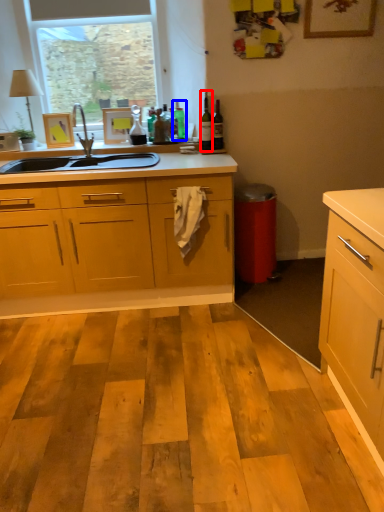
Question: Among these objects, which one is farthest to the camera, bottle (highlighted by a red box) or bottle (highlighted by a blue box)?

Choices:
 (A) bottle
 (B) bottle

Answer: (B)